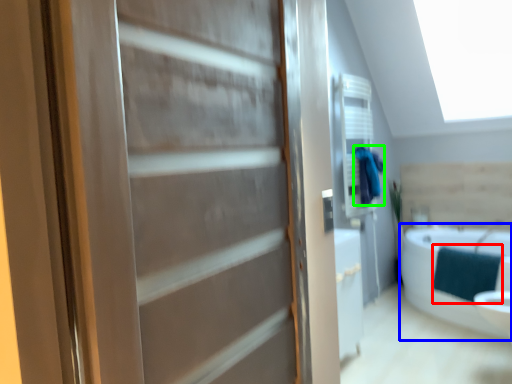
Question: Estimate the real-world distances between objects in this image. Which object is farther from blanket (highlighted by a red box), bathtub (highlighted by a blue box) or bathrobe (highlighted by a green box)?

Choices:
 (A) bathtub
 (B) bathrobe

Answer: (B)